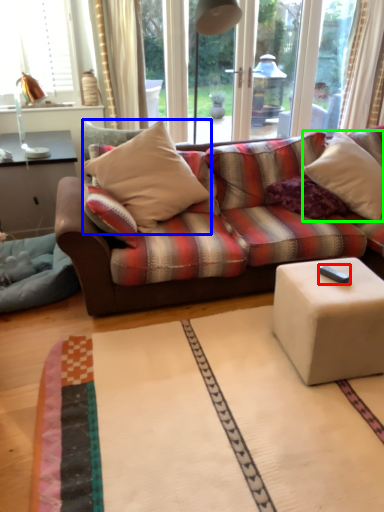
Question: Based on their relative distances, which object is nearer to remote control (highlighted by a red box)? Choose from pillow (highlighted by a blue box) and pillow (highlighted by a green box).

Choices:
 (A) pillow
 (B) pillow

Answer: (B)